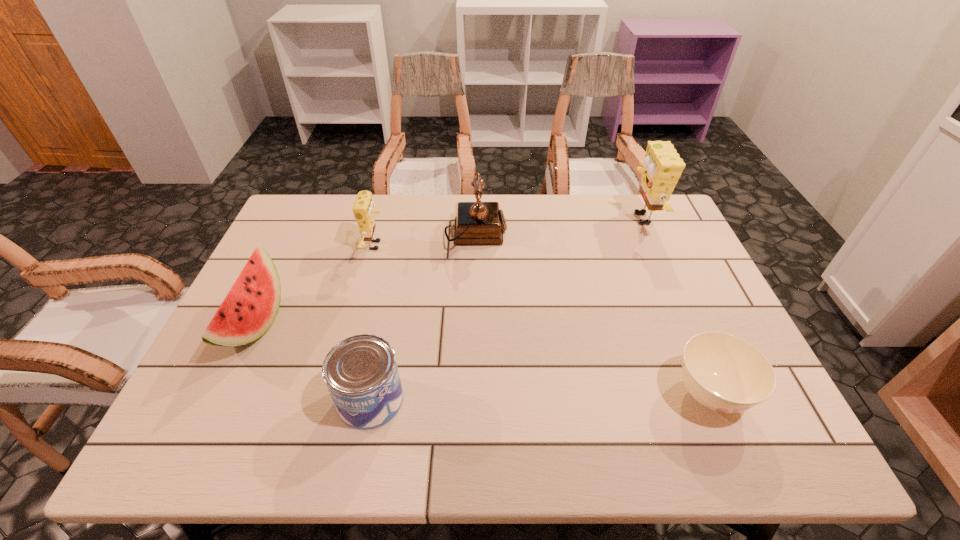
Identify the location of the right sponge. This screenshot has height=540, width=960. (662, 167).

The height and width of the screenshot is (540, 960). I want to click on the taller sponge, so click(662, 167).

This screenshot has width=960, height=540. I want to click on the left sponge, so click(x=363, y=209).

Locate an element on the screen. The width and height of the screenshot is (960, 540). the fourth object from left to right is located at coordinates (477, 223).

This screenshot has width=960, height=540. Identify the location of the leftmost object. (249, 309).

The height and width of the screenshot is (540, 960). I want to click on can, so point(361,373).

Locate an element on the screen. The width and height of the screenshot is (960, 540). the shortest object is located at coordinates (724, 373).

Find the location of a particular element. The image size is (960, 540). vacant space situated 0.240m on the front-facing side of the tallest object is located at coordinates (550, 219).

Find the location of a particular element. This screenshot has height=540, width=960. free space located on the front-facing side of the tallest object is located at coordinates (587, 219).

This screenshot has height=540, width=960. What are the coordinates of `vacant space located on the front-facing side of the tallest object` in the screenshot? It's located at (557, 219).